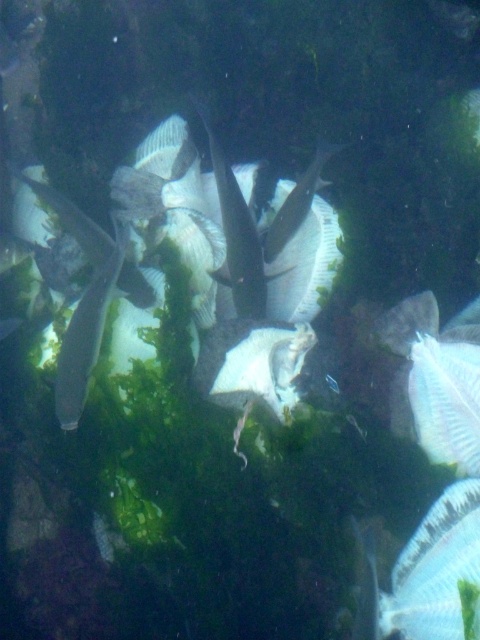
Who is positioned more to the right, translucent white fish at lower right or silvery metallic fish at left?

translucent white fish at lower right

Does translucent white fish at lower right have a lesser width compared to silvery metallic fish at left?

No, translucent white fish at lower right is not thinner than silvery metallic fish at left.

Does point (441, 589) come behind point (80, 324)?

No, (441, 589) is in front of (80, 324).

The image size is (480, 640). Find the location of `translucent white fish at lower right`. translucent white fish at lower right is located at coordinates pos(424,572).